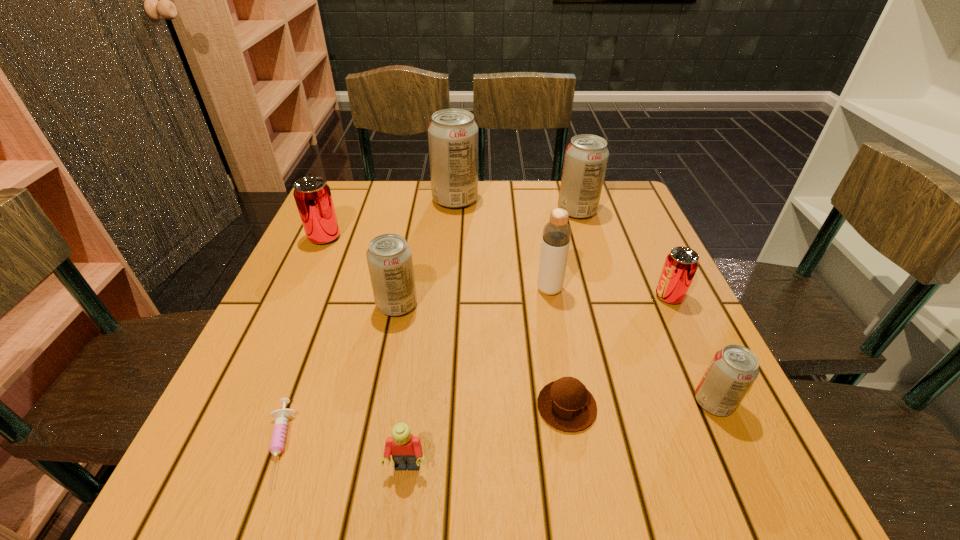
You are a GUI agent. You are given a task and a screenshot of the screen. Output one action in this format:
    pyautogui.click(x=<x>, y=<y>)
    Task: Click on the object present at the far left corner
    The width and height of the screenshot is (960, 540).
    Given the screenshot: What is the action you would take?
    pyautogui.click(x=312, y=195)

Where is `object situated at the near left corner`? object situated at the near left corner is located at coordinates (278, 437).

At what (x,y) coordinates should I click in order to perform the action: click on object that is at the far right corner. Please return your answer as a coordinate pair (x, y). Looking at the image, I should click on (586, 157).

What are the coordinates of `vacant region at the far edge of the desktop` in the screenshot? It's located at (513, 187).

Identify the location of vacant space at the near edge. Image resolution: width=960 pixels, height=540 pixels. (518, 503).

Where is `free space at the left edge`? The image size is (960, 540). free space at the left edge is located at coordinates (310, 273).

Where is `free space at the right edge`? The image size is (960, 540). free space at the right edge is located at coordinates (680, 375).

What are the coordinates of `free region at the far left corner of the desktop` in the screenshot? It's located at (360, 207).

This screenshot has height=540, width=960. Identify the location of vacant space at the near right corner of the desktop. (772, 479).

This screenshot has height=540, width=960. Find the location of `free space between the syringe and the nearest soda can`. free space between the syringe and the nearest soda can is located at coordinates (494, 424).